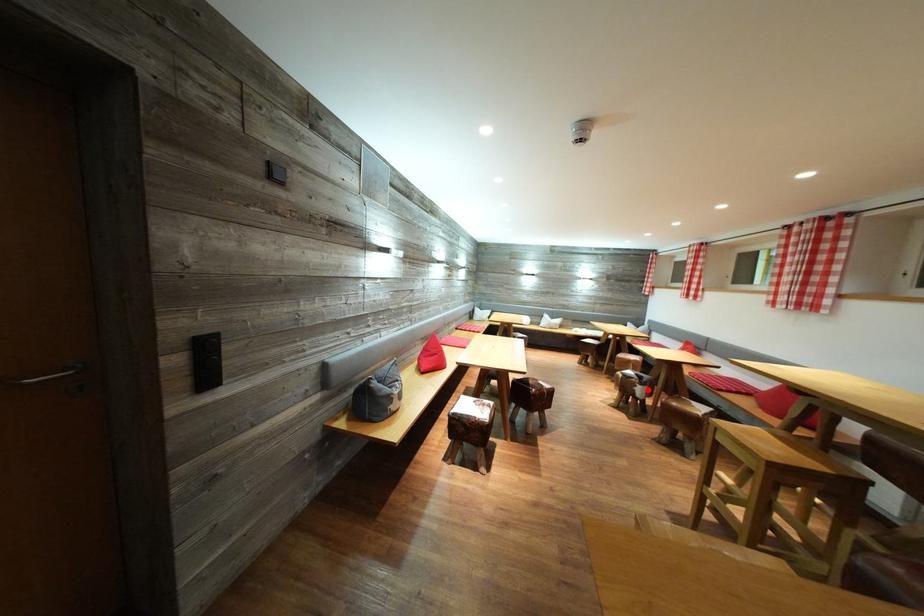
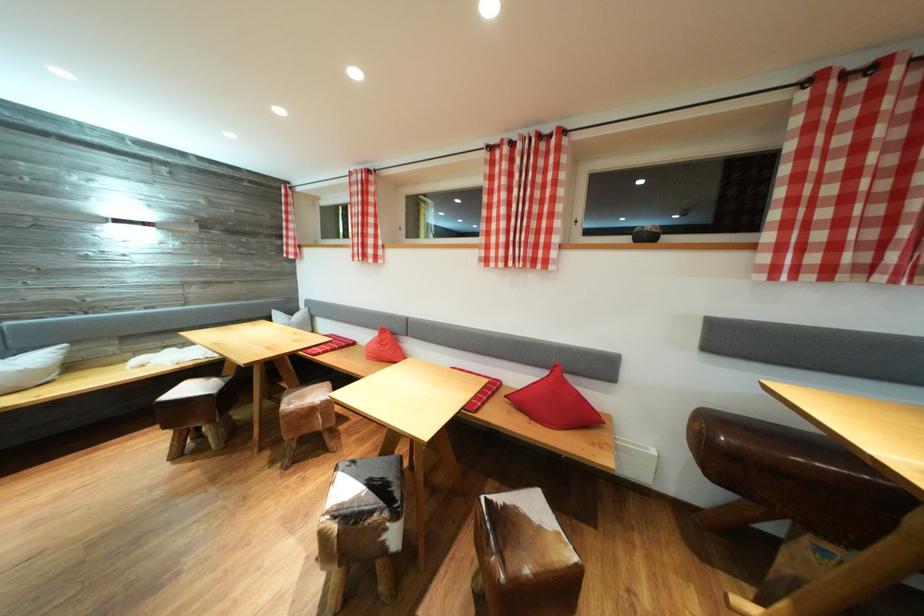
Locate, in the second image, the point that corresponds to the highlighted location in the first image.

(403, 522)